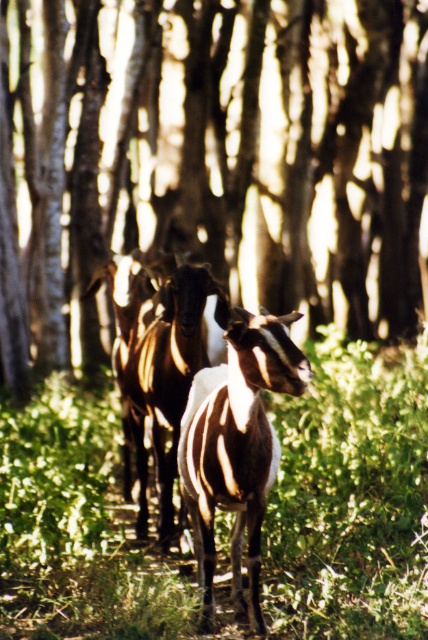
Between point (398, 161) and point (241, 476), which one is positioned in front?

Positioned in front is point (241, 476).

You are a GUI agent. You are given a task and a screenshot of the screen. Output one action in this format:
    pyautogui.click(x=<x>, y=<y>)
    Task: Click on the brown wood tree at center
    Image resolution: width=428 pixels, height=640 pixels.
    Given the screenshot: What is the action you would take?
    pyautogui.click(x=214, y=154)

Who is positioned more to the left, green leafy grass at center or brown textured goat at center?

brown textured goat at center is more to the left.

In the scene shown: Which is below, green leafy grass at center or brown textured goat at center?

green leafy grass at center

Locate an element on the screen. green leafy grass at center is located at coordinates click(350, 497).

Where is `green leafy grass at center`? green leafy grass at center is located at coordinates [350, 497].

Can you confirm if white and brown fur goat at center is positioned above brown textured goat at center?

No.

Is white and brown fur goat at center to the left of brown textured goat at center from the viewer's perspective?

Incorrect, white and brown fur goat at center is not on the left side of brown textured goat at center.

Which is behind, point (205, 628) or point (148, 336)?

The point (148, 336) is more distant.

You are a GUI agent. You are given a task and a screenshot of the screen. Output one action in this format:
    pyautogui.click(x=<x>, y=<y>)
    Task: Click on the white and brown fur goat at center
    Image resolution: width=428 pixels, height=640 pixels.
    Given the screenshot: What is the action you would take?
    pyautogui.click(x=235, y=444)